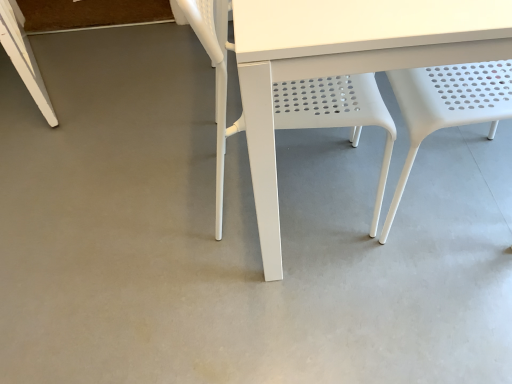
The height and width of the screenshot is (384, 512). I want to click on vacant area that is in front of white perforated plastic chair at center, which is the first chair in right-to-left order, so click(x=439, y=298).